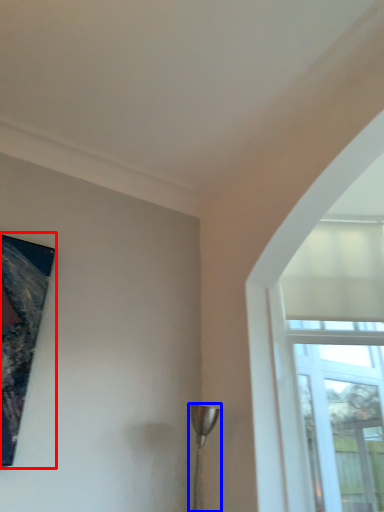
Question: Which point is closer to the camera, picture frame (highlighted by a red box) or lamp (highlighted by a blue box)?

Choices:
 (A) picture frame
 (B) lamp

Answer: (A)